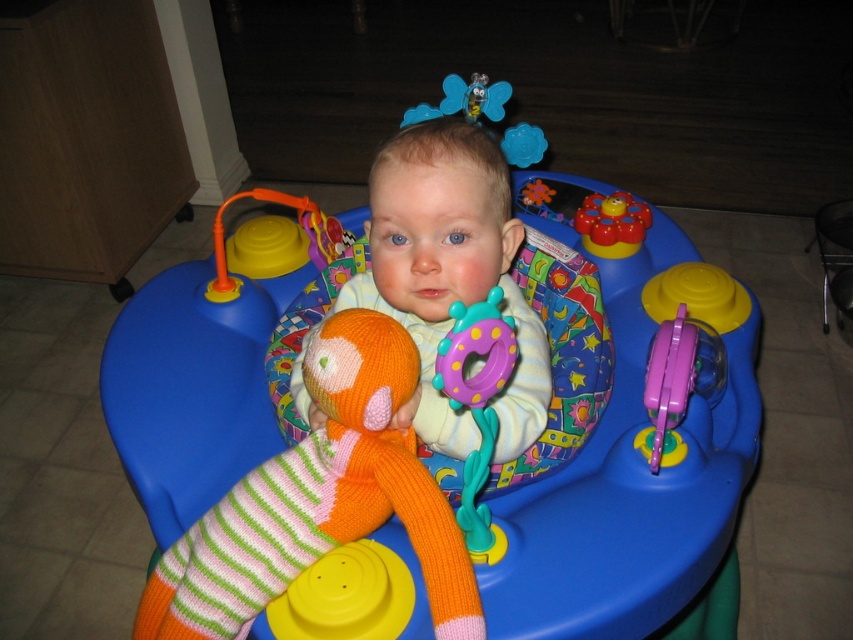
You are a parent who wants to place a small toy between the orange knitted sock at center and the rubberized purple phone at center right. Based on their heights, which object should you place the toy closer to?

The orange knitted sock at center is taller than the rubberized purple phone at center right, so you should place the toy closer to the rubberized purple phone at center right to ensure stability.

You are a parent trying to locate the rubberized purple phone at center right and the rubberized yellow flower at center for your child. Based on the scene, which object is positioned lower in the activity center?

The rubberized purple phone at center right is located below the rubberized yellow flower at center, so it is positioned lower in the activity center.